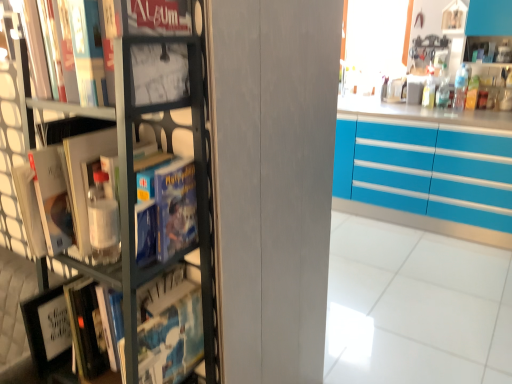
Question: Considering the relative positions of matte black book at upper left and turquoise glossy cabinets at right in the image provided, is matte black book at upper left to the left of turquoise glossy cabinets at right from the viewer's perspective?

Choices:
 (A) no
 (B) yes

Answer: (B)

Question: Is matte black book at upper left shorter than turquoise glossy cabinets at right?

Choices:
 (A) yes
 (B) no

Answer: (A)

Question: Is matte black book at upper left touching turquoise glossy cabinets at right?

Choices:
 (A) no
 (B) yes

Answer: (A)

Question: Is matte black book at upper left looking in the opposite direction of turquoise glossy cabinets at right?

Choices:
 (A) no
 (B) yes

Answer: (A)

Question: From a real-world perspective, does matte black book at upper left stand above turquoise glossy cabinets at right?

Choices:
 (A) yes
 (B) no

Answer: (A)

Question: In terms of height, does metallic gray bookcase at left look taller or shorter compared to matte black book at upper left?

Choices:
 (A) tall
 (B) short

Answer: (A)

Question: From a real-world perspective, is metallic gray bookcase at left above or below matte black book at upper left?

Choices:
 (A) below
 (B) above

Answer: (A)

Question: Is metallic gray bookcase at left bigger or smaller than matte black book at upper left?

Choices:
 (A) big
 (B) small

Answer: (A)

Question: Is point (137, 307) positioned closer to the camera than point (161, 26)?

Choices:
 (A) farther
 (B) closer

Answer: (A)

Question: Considering the positions of matte black book at upper left and turquoise glossy cabinets at right in the image, is matte black book at upper left taller or shorter than turquoise glossy cabinets at right?

Choices:
 (A) tall
 (B) short

Answer: (B)

Question: Looking at the image, does matte black book at upper left seem bigger or smaller compared to turquoise glossy cabinets at right?

Choices:
 (A) small
 (B) big

Answer: (A)

Question: Is matte black book at upper left inside the boundaries of turquoise glossy cabinets at right, or outside?

Choices:
 (A) outside
 (B) inside

Answer: (A)

Question: From a real-world perspective, relative to turquoise glossy cabinets at right, is matte black book at upper left vertically above or below?

Choices:
 (A) above
 (B) below

Answer: (A)

Question: Is turquoise glossy cabinets at right bigger or smaller than matte black book at upper left?

Choices:
 (A) big
 (B) small

Answer: (A)

Question: Considering the relative positions of turquoise glossy cabinets at right and matte black book at upper left in the image provided, is turquoise glossy cabinets at right to the left or to the right of matte black book at upper left?

Choices:
 (A) left
 (B) right

Answer: (B)